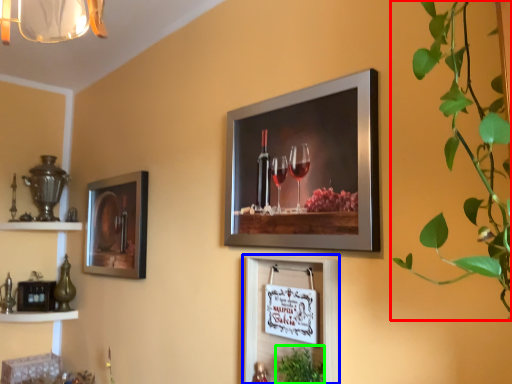
Question: Which object is positioned farthest from houseplant (highlighted by a red box)? Select from picture frame (highlighted by a blue box) and plant (highlighted by a green box).

Choices:
 (A) picture frame
 (B) plant

Answer: (B)